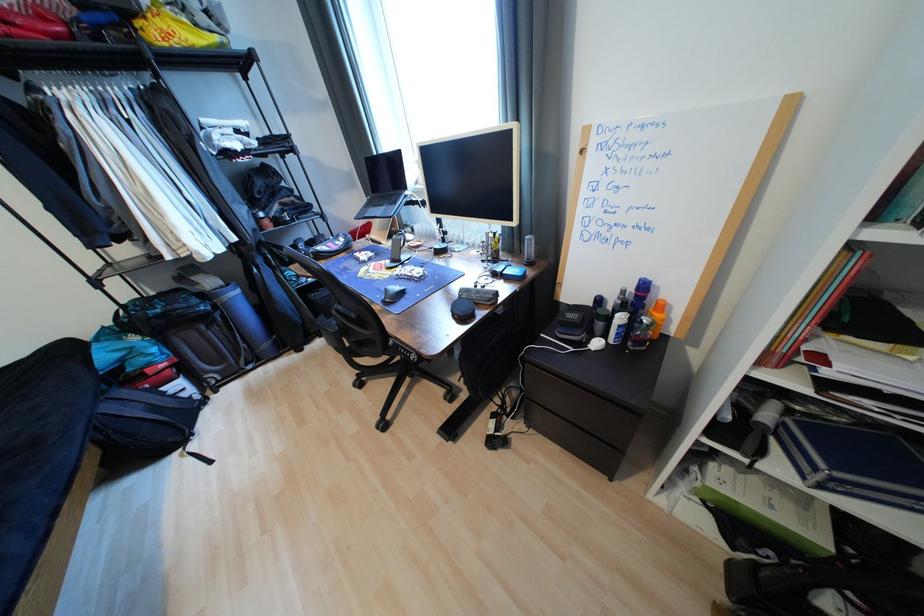
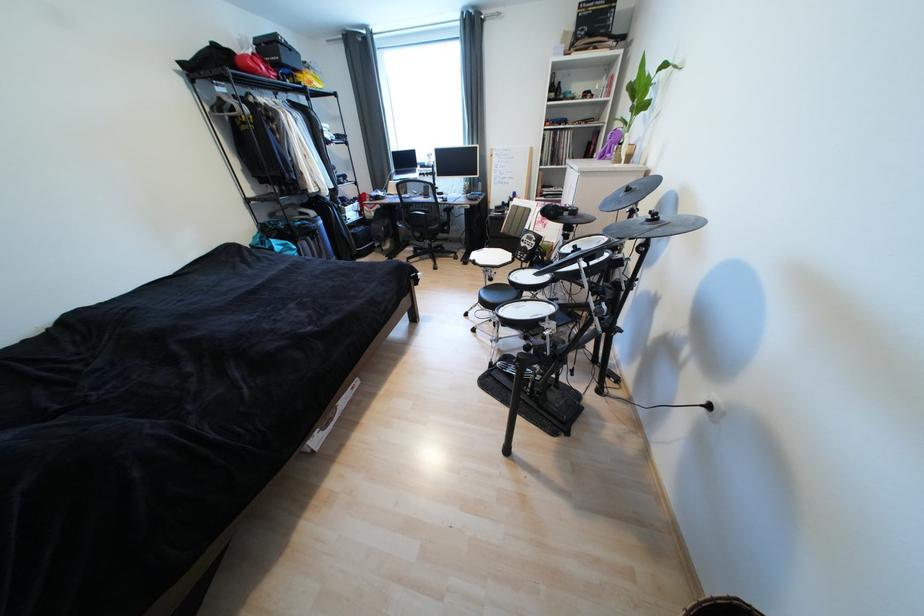
Question: I am providing you with two images of the same scene from different viewpoints. Please identify which objects are invisible in image2.

Choices:
 (A) woven basket
 (B) black stool sitting surface
 (C) light gray pillow
 (D) laptop computer

Answer: (D)